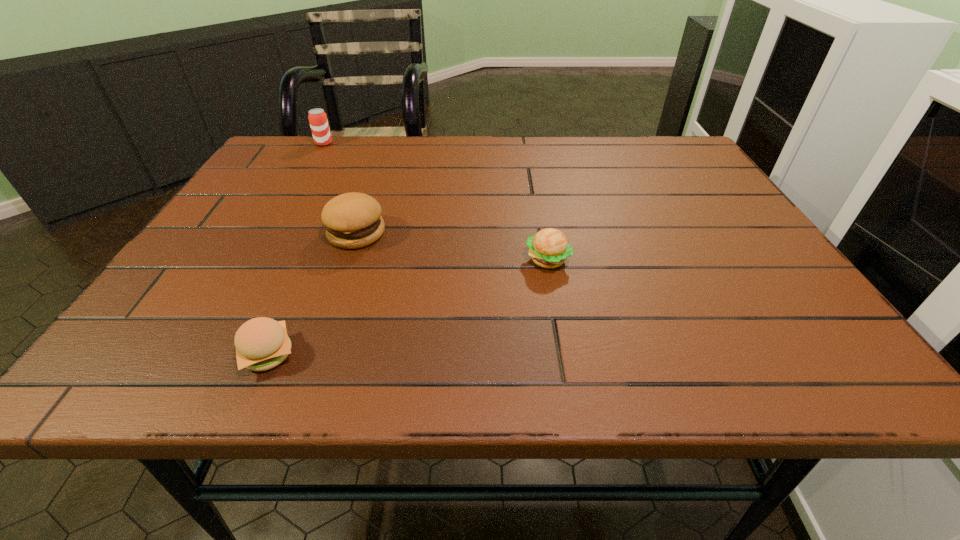
I want to click on the leftmost object, so click(317, 117).

Find the location of a particular element. This screenshot has height=540, width=960. the farthest object is located at coordinates (317, 117).

What are the coordinates of `the tallest hamburger` in the screenshot? It's located at (353, 220).

Find the location of a particular element. the rightmost hamburger is located at coordinates (548, 248).

Locate an element on the screen. The height and width of the screenshot is (540, 960). the nearest hamburger is located at coordinates (262, 343).

Locate an element on the screen. The width and height of the screenshot is (960, 540). free spot located on the front of the farthest object is located at coordinates (295, 194).

The image size is (960, 540). Identify the location of vacant point located 0.230m on the front of the tallest hamburger. (321, 338).

You are a GUI agent. You are given a task and a screenshot of the screen. Output one action in this format:
    pyautogui.click(x=<x>, y=<y>)
    Task: Click on the blank space located on the left of the rightmost hamburger
    Image resolution: width=960 pixels, height=540 pixels.
    Given the screenshot: What is the action you would take?
    pyautogui.click(x=435, y=260)

In order to click on free location located 0.080m on the right of the nearest hamburger in this screenshot , I will do `click(348, 354)`.

The height and width of the screenshot is (540, 960). What are the coordinates of `object that is at the far edge` in the screenshot? It's located at (317, 117).